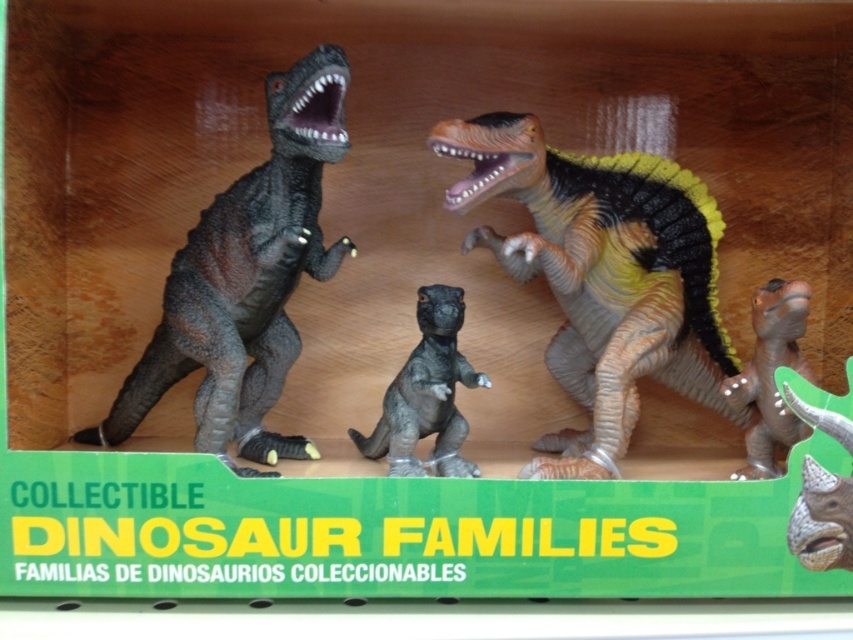
In the scene shown: You are a collector who wants to place a new dinosaur figure between the matte gray plastic dinosaur at center and the brown matte dinosaur at center in the box. The new figure is 12 inches long. Is there enough space between them to fit the new dinosaur?

The distance between the matte gray plastic dinosaur at center and the brown matte dinosaur at center is 13.30 inches. Since the new dinosaur is 12 inches long, there is enough space to fit it between them.